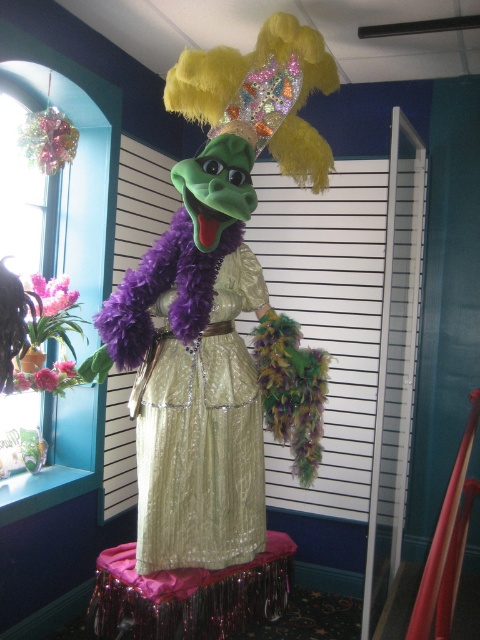
Question: Which point appears farthest from the camera in this image?

Choices:
 (A) (128, 550)
 (B) (232, 294)

Answer: (A)

Question: Which point appears closest to the camera in this image?

Choices:
 (A) click(200, 577)
 (B) click(172, 90)
 (C) click(173, 433)

Answer: (C)

Question: Estimate the real-world distances between objects in this image. Which object is farther from the purple sequined skirt at center?

Choices:
 (A) gold sequined dress at center
 (B) shiny gold dress at center

Answer: (B)

Question: Can you confirm if gold sequined dress at center is smaller than purple sequined skirt at center?

Choices:
 (A) no
 (B) yes

Answer: (B)

Question: Does gold sequined dress at center appear on the left side of purple sequined skirt at center?

Choices:
 (A) yes
 (B) no

Answer: (B)

Question: From the image, what is the correct spatial relationship of shiny gold dress at center in relation to purple sequined skirt at center?

Choices:
 (A) above
 (B) below

Answer: (A)